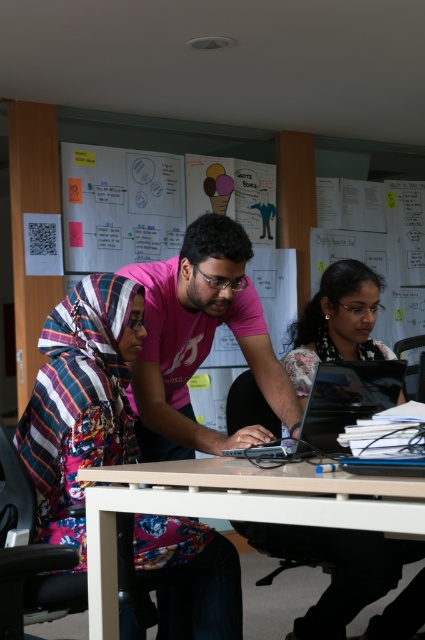
Between point (261, 536) and point (170, 504), which one is positioned behind?

The point (261, 536) is more distant.

Does matte black laptop at center have a greater height compared to white glossy table at center?

Indeed, matte black laptop at center has a greater height compared to white glossy table at center.

Where is `matte black laptop at center`? Image resolution: width=425 pixels, height=640 pixels. matte black laptop at center is located at coordinates click(337, 570).

This screenshot has width=425, height=640. I want to click on matte black laptop at center, so click(337, 570).

Is patterned fabric hijab at center positioned behind pink matte shirt at center?

No, patterned fabric hijab at center is closer to the viewer.

Is patterned fabric hijab at center to the left of pink matte shirt at center from the viewer's perspective?

Indeed, patterned fabric hijab at center is positioned on the left side of pink matte shirt at center.

Is point (119, 316) farther from camera compared to point (186, 342)?

No, it is in front of (186, 342).

This screenshot has height=640, width=425. I want to click on patterned fabric hijab at center, so tap(81, 400).

Which is more to the right, patterned fabric hijab at center or matte black laptop at center?

matte black laptop at center is more to the right.

In the scene shown: Who is more distant from viewer, (54, 353) or (255, 538)?

The point (255, 538) is behind.

Between point (138, 340) and point (308, 365), which one is positioned behind?

The point (308, 365) is behind.

Where is `patterned fabric hijab at center`? patterned fabric hijab at center is located at coordinates (81, 400).